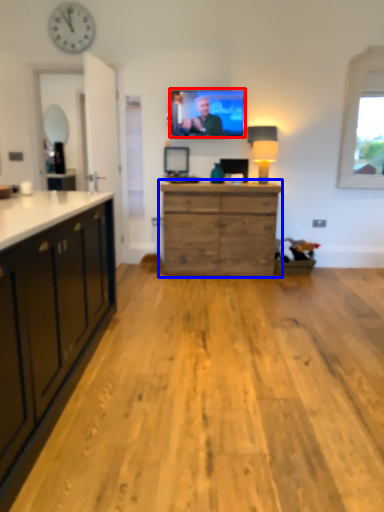
Question: Which point is further to the camera, television (highlighted by a red box) or chest of drawers (highlighted by a blue box)?

Choices:
 (A) television
 (B) chest of drawers

Answer: (A)